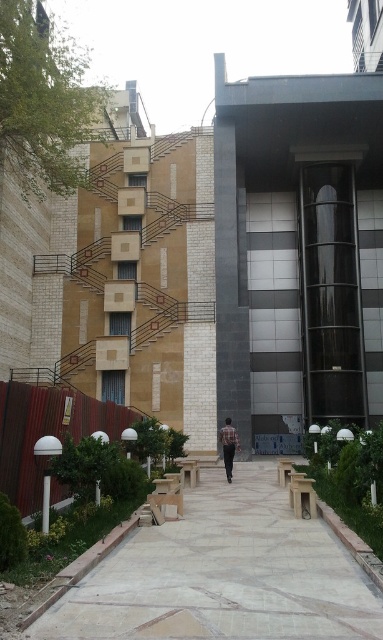
Question: Which object is closer to the camera taking this photo?

Choices:
 (A) light gray concrete pavement at center
 (B) brown plaid shirt at center

Answer: (A)

Question: Which object is closer to the camera taking this photo?

Choices:
 (A) brown plaid shirt at center
 (B) light gray concrete pavement at center

Answer: (B)

Question: Is light gray concrete pavement at center closer to the viewer compared to brown plaid shirt at center?

Choices:
 (A) no
 (B) yes

Answer: (B)

Question: Can you confirm if light gray concrete pavement at center is smaller than brown plaid shirt at center?

Choices:
 (A) yes
 (B) no

Answer: (B)

Question: Can you confirm if light gray concrete pavement at center is positioned below brown plaid shirt at center?

Choices:
 (A) yes
 (B) no

Answer: (B)

Question: Which object appears farthest from the camera in this image?

Choices:
 (A) brown plaid shirt at center
 (B) light gray concrete pavement at center

Answer: (A)